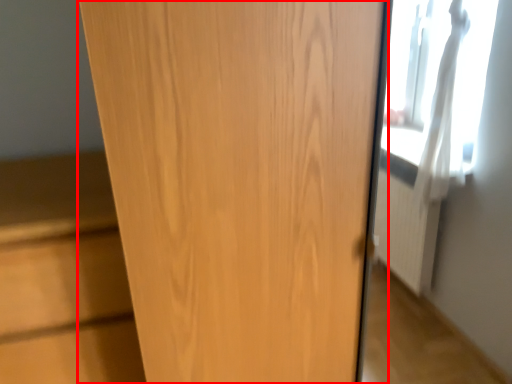
Question: Considering the relative positions of door (annotated by the red box) and cabinetry in the image provided, where is door (annotated by the red box) located with respect to the staircase?

Choices:
 (A) left
 (B) right

Answer: (B)